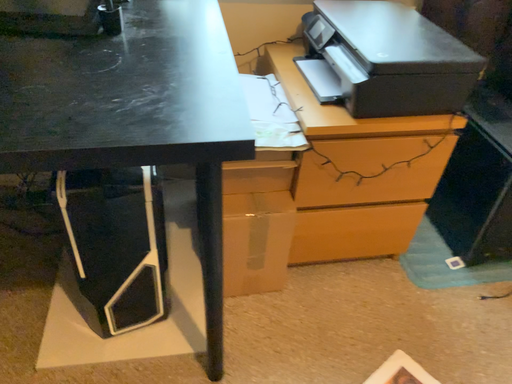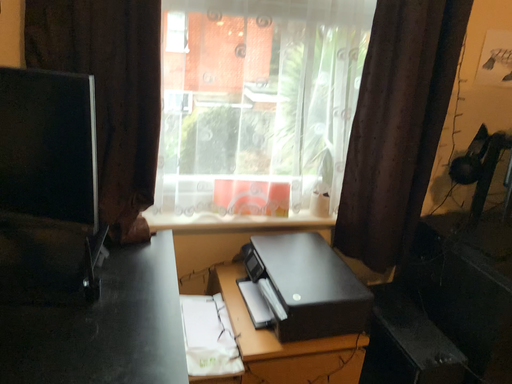
Question: Which way did the camera rotate in the video?

Choices:
 (A) rotated upward
 (B) rotated downward

Answer: (A)